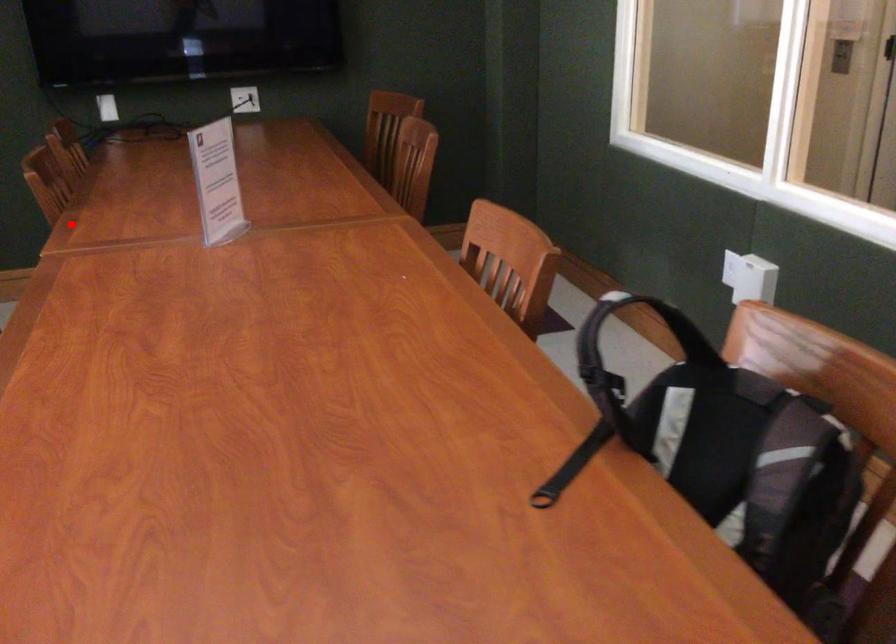
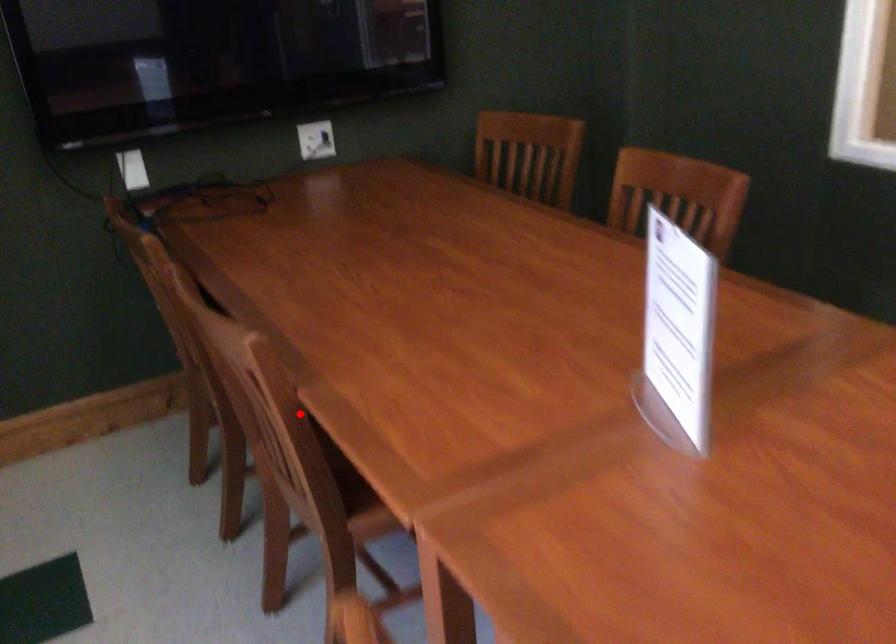
I am providing you with two images of the same scene from different viewpoints. A red point is marked on the first image and another point is marked on the second image. Do the highlighted points in image1 and image2 indicate the same real-world spot?

Yes